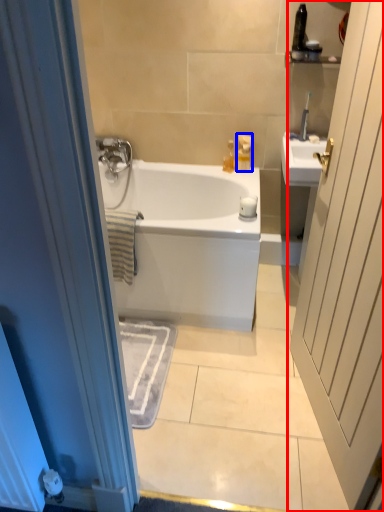
Question: Which point is further to the camera, door (highlighted by a red box) or toiletry (highlighted by a blue box)?

Choices:
 (A) door
 (B) toiletry

Answer: (B)